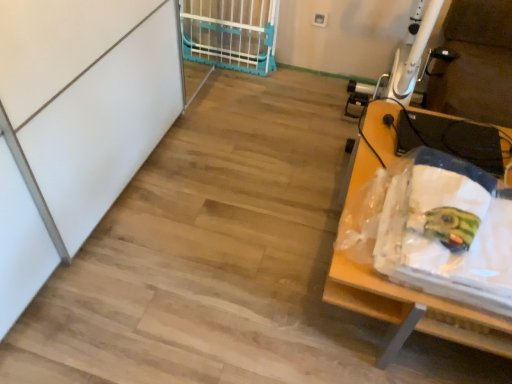
The image size is (512, 384). Find the location of `free area below blue plastic gate at upper center (from a real-world perspective)`. free area below blue plastic gate at upper center (from a real-world perspective) is located at coordinates 223,64.